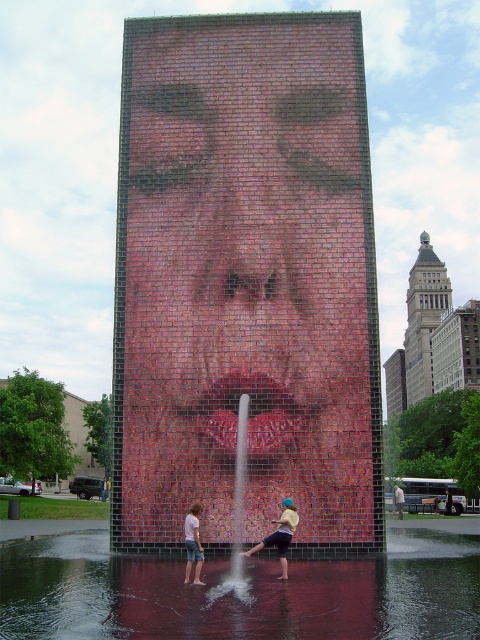
Measure the distance between point (142,586) and camera.

17.81 meters

Which is behind, point (460, 600) or point (291, 522)?

Positioned behind is point (291, 522).

Which is behind, point (252, 600) or point (283, 529)?

The point (283, 529) is behind.

In order to click on clear water at center in this screenshot , I will do `click(240, 593)`.

How much distance is there between clear water at center and denim shorts at lower center?

They are 4.01 meters apart.

Is point (475, 600) positioned before point (193, 550)?

Yes, point (475, 600) is in front of point (193, 550).

This screenshot has height=640, width=480. I want to click on clear water at center, so click(240, 593).

You are a GUI agent. You are given a task and a screenshot of the screen. Output one action in this format:
    pyautogui.click(x=<x>, y=<y>)
    Task: Click on the brick mosaic face at center
    
    Given the screenshot: What is the action you would take?
    pyautogui.click(x=245, y=280)

The width and height of the screenshot is (480, 640). What are the coordinates of `brick mosaic face at center` in the screenshot? It's located at (245, 280).